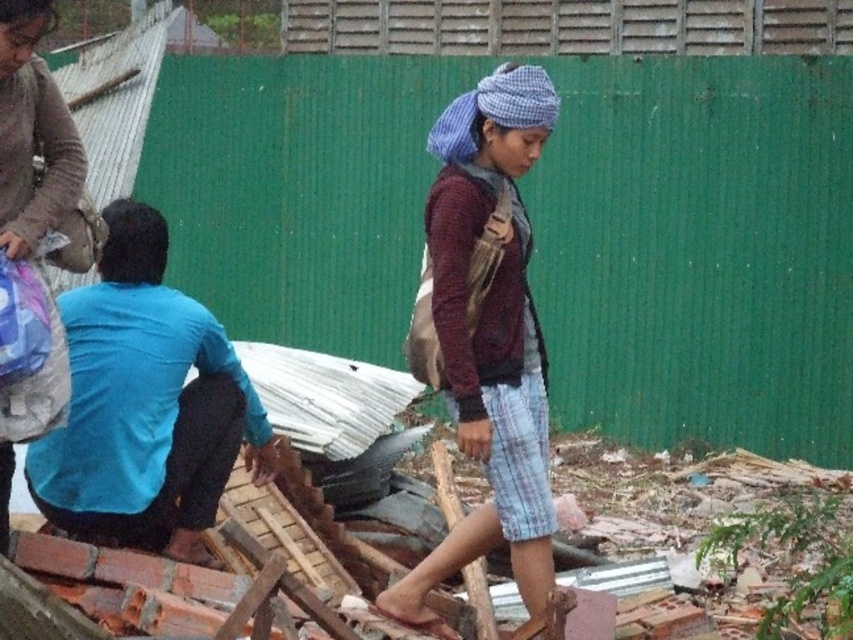
Question: Which object is positioned closest to the maroon knitted sweater at center?

Choices:
 (A) matte gray sweater at upper left
 (B) blue long-sleeve shirt at left

Answer: (B)

Question: Which point appears closest to the camera in this image?

Choices:
 (A) (546, 124)
 (B) (50, 168)
 (C) (96, 376)

Answer: (B)

Question: Can you confirm if blue long-sleeve shirt at left is positioned above matte gray sweater at upper left?

Choices:
 (A) no
 (B) yes

Answer: (A)

Question: Is the position of blue long-sleeve shirt at left more distant than that of matte gray sweater at upper left?

Choices:
 (A) yes
 (B) no

Answer: (A)

Question: Does blue long-sleeve shirt at left have a greater width compared to matte gray sweater at upper left?

Choices:
 (A) yes
 (B) no

Answer: (A)

Question: Which of the following is the farthest from the observer?

Choices:
 (A) (59, 160)
 (B) (457, 150)
 (C) (143, 220)

Answer: (C)